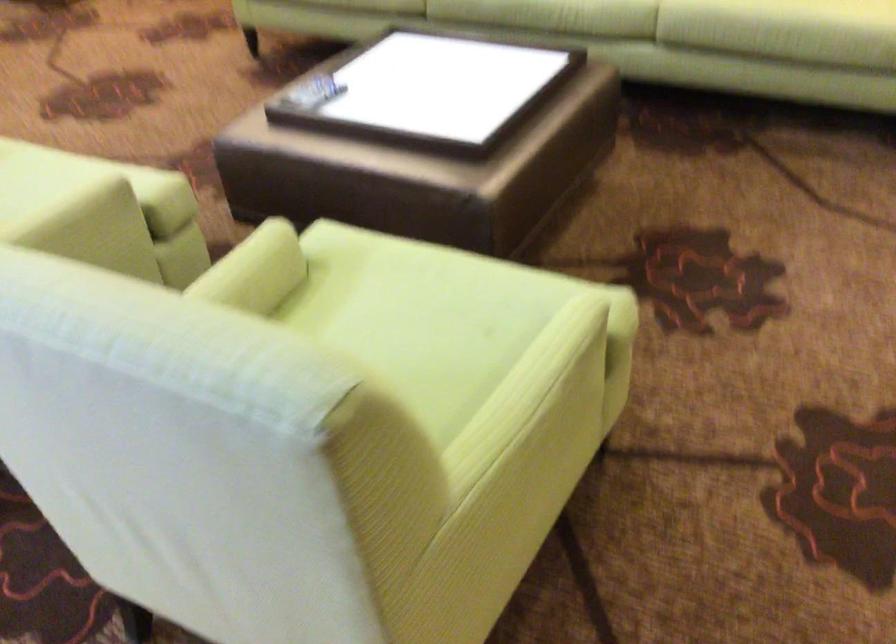
What do you see at coordinates (528, 393) in the screenshot? I see `a light green armrest` at bounding box center [528, 393].